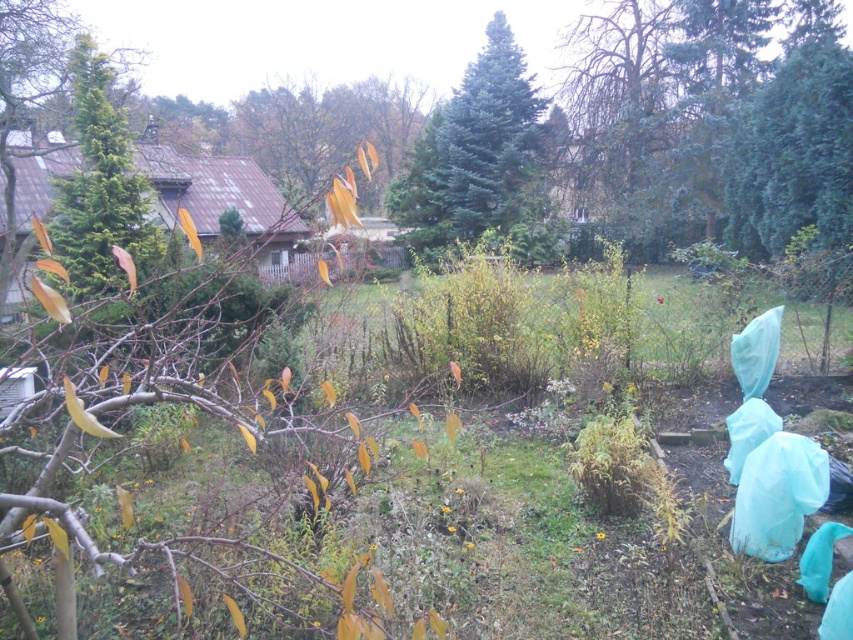
Question: Is green matte evergreen tree at center bigger than green needle-like tree at left?

Choices:
 (A) no
 (B) yes

Answer: (B)

Question: Among these points, which one is farthest from the camera?

Choices:
 (A) (451, 202)
 (B) (126, 218)

Answer: (A)

Question: Does green matte evergreen tree at center lie in front of green needle-like tree at left?

Choices:
 (A) yes
 (B) no

Answer: (B)

Question: Which point is closer to the camera taking this photo?

Choices:
 (A) (480, 204)
 (B) (83, 49)

Answer: (B)

Question: Is green matte evergreen tree at center bigger than green needle-like tree at left?

Choices:
 (A) no
 (B) yes

Answer: (B)